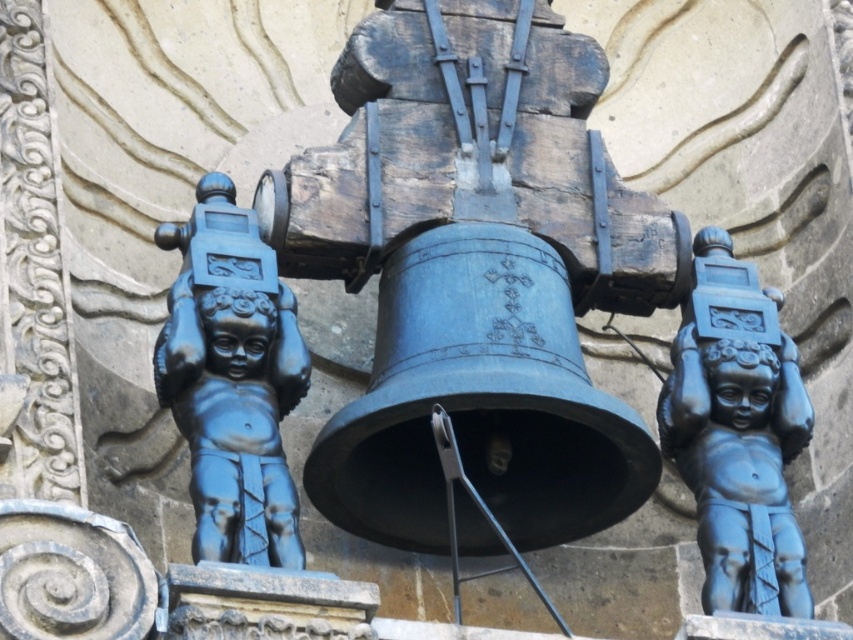
You are standing in front of the building facade and want to take a photo of the bell and the two cherubic statues. The camera you are using has a maximum focus range of 60 meters. Will the point at coordinates point [299,333] be in focus?

The point at coordinates point [299,333] is 67.78 meters away from the camera, which exceeds the maximum focus range of 60 meters. Therefore, the point will not be in focus.

You are standing in front of the building and notice two cherub statues. One is at point (231, 380). Which cherub is positioned at that coordinate?

The matte black cherub at left is positioned at point (231, 380).